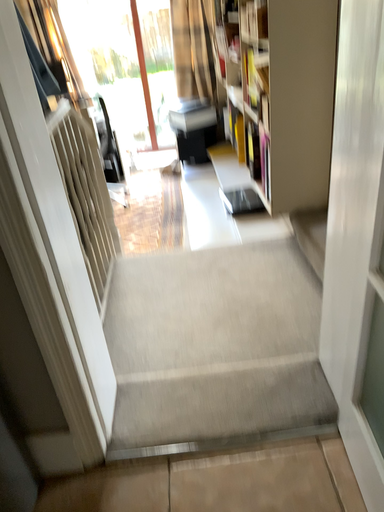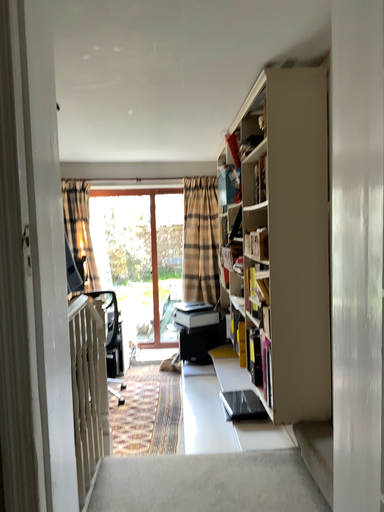
Question: How did the camera likely rotate when shooting the video?

Choices:
 (A) rotated upward
 (B) rotated downward

Answer: (A)